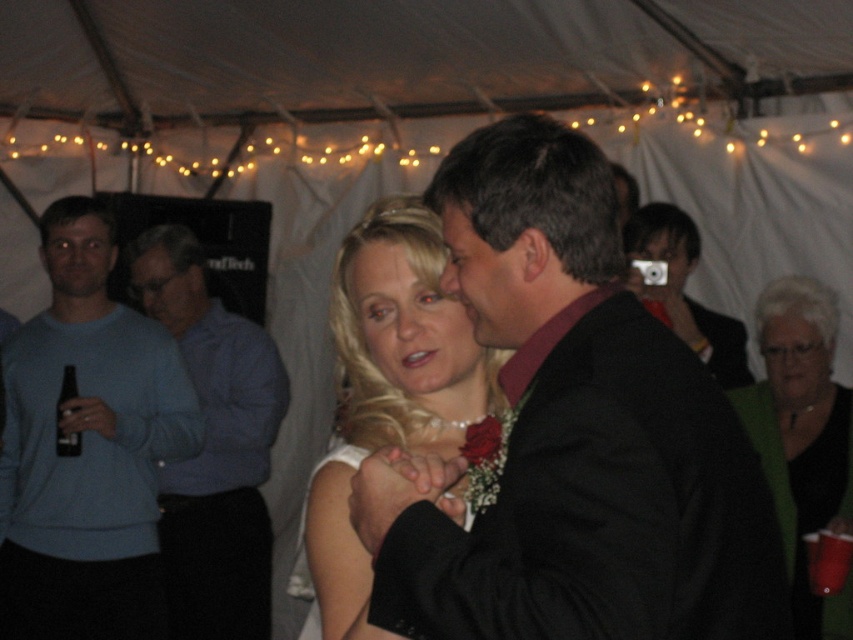
Does black satin dress at lower right appear over matte blonde hair at center?

No, black satin dress at lower right is not above matte blonde hair at center.

Can you confirm if black satin dress at lower right is shorter than matte blonde hair at center?

No, black satin dress at lower right is not shorter than matte blonde hair at center.

Locate an element on the screen. The image size is (853, 640). black satin dress at lower right is located at coordinates (802, 436).

Where is `black satin dress at lower right`? This screenshot has height=640, width=853. black satin dress at lower right is located at coordinates (802, 436).

Between blue shirt at left and black glass bottle at left, which one is positioned higher?

black glass bottle at left is higher up.

Does point (163, 321) lie in front of point (71, 365)?

No.

Where is `blue shirt at left`? This screenshot has width=853, height=640. blue shirt at left is located at coordinates (213, 445).

Is point (643, 595) positioned in front of point (99, 538)?

Yes.

What do you see at coordinates (573, 435) in the screenshot? The height and width of the screenshot is (640, 853). I see `black satin suit at center` at bounding box center [573, 435].

Where is `black satin suit at center`? This screenshot has width=853, height=640. black satin suit at center is located at coordinates (573, 435).